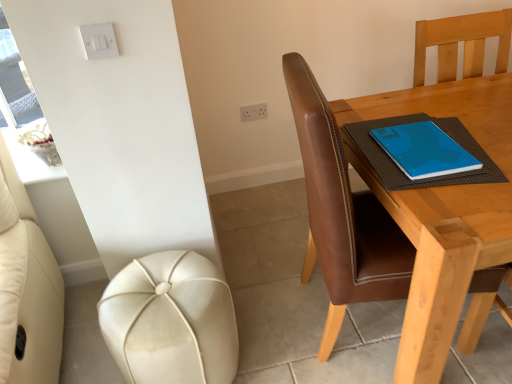
The height and width of the screenshot is (384, 512). I want to click on free location above leather-like cream stool at lower left (from a real-world perspective), so click(156, 299).